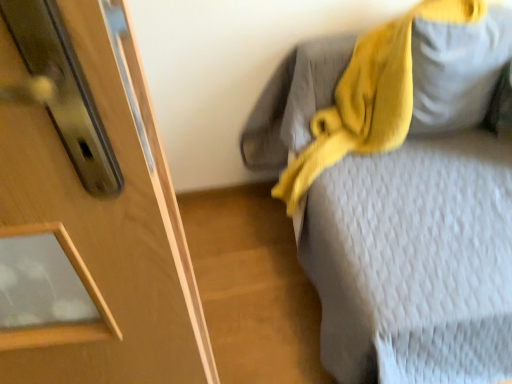
This screenshot has width=512, height=384. Describe the element at coordinates (400, 207) in the screenshot. I see `textured gray bed at upper right` at that location.

What are the coordinates of `textured gray bed at upper right` in the screenshot? It's located at (400, 207).

The height and width of the screenshot is (384, 512). What do you see at coordinates (457, 70) in the screenshot?
I see `matte gray pillow at upper right` at bounding box center [457, 70].

The width and height of the screenshot is (512, 384). Find the location of `textured gray bed at upper right`. textured gray bed at upper right is located at coordinates (400, 207).

How different are the orientations of matte gray pillow at upper right and textured gray bed at upper right in degrees?

3.42 degrees separate the facing orientations of matte gray pillow at upper right and textured gray bed at upper right.

Consider the image. Is matte gray pillow at upper right smaller than textured gray bed at upper right?

Yes.

In the image, there is a textured gray bed at upper right. Identify the location of gray above it (from the image's perspective). The width and height of the screenshot is (512, 384). (457, 70).

Is matte gray pillow at upper right beside textured gray bed at upper right?

No, matte gray pillow at upper right is not touching textured gray bed at upper right.

Can you tell me how much textured gray bed at upper right and matte gray pillow at upper right differ in facing direction?

There is a 3.42-degree angle between the facing directions of textured gray bed at upper right and matte gray pillow at upper right.

Where is `gray that appears above the textured gray bed at upper right (from a real-world perspective)`? gray that appears above the textured gray bed at upper right (from a real-world perspective) is located at coordinates (457, 70).

From the picture: From the image's perspective, relative to matte gray pillow at upper right, is textured gray bed at upper right above or below?

Based on their image positions, textured gray bed at upper right is located beneath matte gray pillow at upper right.

From a real-world perspective, is textured gray bed at upper right located beneath matte gray pillow at upper right?

Correct, in the physical world, textured gray bed at upper right is lower than matte gray pillow at upper right.

In the scene shown: From the image's perspective, is textured gray bed at upper right under yellow knitted scarf at upper right?

Yes.

Does textured gray bed at upper right turn towards yellow knitted scarf at upper right?

No, textured gray bed at upper right is not facing towards yellow knitted scarf at upper right.

Does yellow knitted scarf at upper right have a smaller size compared to textured gray bed at upper right?

Correct, yellow knitted scarf at upper right occupies less space than textured gray bed at upper right.

Which object is positioned more to the right, yellow knitted scarf at upper right or textured gray bed at upper right?

From the viewer's perspective, textured gray bed at upper right appears more on the right side.

From the image's perspective, is yellow knitted scarf at upper right positioned above or below textured gray bed at upper right?

yellow knitted scarf at upper right is situated higher than textured gray bed at upper right in the image.

Where is `scarf located in front of the matte gray pillow at upper right`? The image size is (512, 384). scarf located in front of the matte gray pillow at upper right is located at coordinates (370, 97).

Is yellow knitted scarf at upper right completely or partially outside of matte gray pillow at upper right?

Yes, yellow knitted scarf at upper right is outside of matte gray pillow at upper right.

Who is shorter, yellow knitted scarf at upper right or matte gray pillow at upper right?

Standing shorter between the two is matte gray pillow at upper right.

Which of these two, yellow knitted scarf at upper right or matte gray pillow at upper right, is bigger?

yellow knitted scarf at upper right is bigger.

From the image's perspective, between matte gray pillow at upper right and yellow knitted scarf at upper right, which one is located above?

matte gray pillow at upper right.

How much distance is there between matte gray pillow at upper right and yellow knitted scarf at upper right?

A distance of 5.24 inches exists between matte gray pillow at upper right and yellow knitted scarf at upper right.

Is matte gray pillow at upper right to the left of yellow knitted scarf at upper right from the viewer's perspective?

In fact, matte gray pillow at upper right is to the right of yellow knitted scarf at upper right.

What are the coordinates of `furniture in front of the matte gray pillow at upper right` in the screenshot? It's located at (400, 207).

Identify the location of furniture on the left of matte gray pillow at upper right. The height and width of the screenshot is (384, 512). (x=400, y=207).

Looking at the image, which one is located closer to textured gray bed at upper right, matte gray pillow at upper right or yellow knitted scarf at upper right?

yellow knitted scarf at upper right lies closer to textured gray bed at upper right than the other object.

Based on their spatial positions, is textured gray bed at upper right or yellow knitted scarf at upper right closer to matte gray pillow at upper right?

yellow knitted scarf at upper right.

Estimate the real-world distances between objects in this image. Which object is further from matte gray pillow at upper right, yellow knitted scarf at upper right or textured gray bed at upper right?

textured gray bed at upper right is positioned further to the anchor matte gray pillow at upper right.

From the image, which object appears to be nearer to textured gray bed at upper right, yellow knitted scarf at upper right or matte gray pillow at upper right?

yellow knitted scarf at upper right is positioned closer to the anchor textured gray bed at upper right.

In the scene shown: Which object lies further to the anchor point yellow knitted scarf at upper right, textured gray bed at upper right or matte gray pillow at upper right?

Among the two, textured gray bed at upper right is located further to yellow knitted scarf at upper right.

Looking at the image, which one is located closer to yellow knitted scarf at upper right, matte gray pillow at upper right or textured gray bed at upper right?

matte gray pillow at upper right is positioned closer to the anchor yellow knitted scarf at upper right.

Identify the location of scarf between textured gray bed at upper right and matte gray pillow at upper right in the front-back direction. (370, 97).